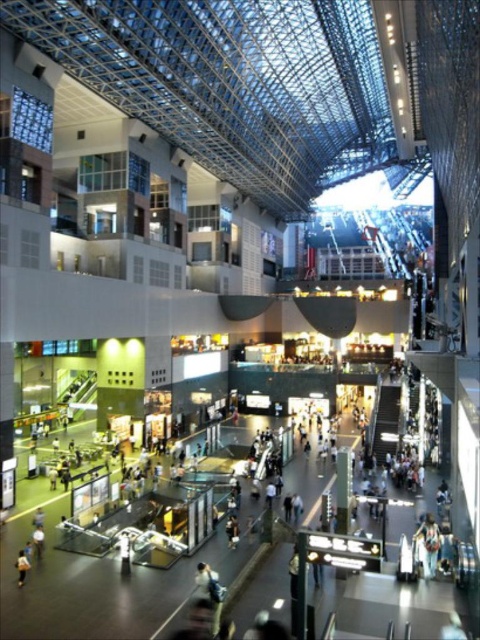
You are a delivery robot with a 100 feet range. You are currently at the floral fabric dress at center and need to deliver a package to the white fabric person at center. Can you reach them without needing to recharge?

The distance between the floral fabric dress at center and the white fabric person at center is 93.82 feet, which is within the robot 100 feet range. Therefore, the robot can reach them without needing to recharge.

You are a customer in the mall and want to pick up the floral fabric dress at center and the light brown leather jacket at lower left. However, you notice that the jacket is partially hidden. Can you tell which item is closer to you?

The light brown leather jacket at lower left is behind the floral fabric dress at center, so the floral fabric dress at center is closer to you.

You are standing at the entrance of the mall and see two points marked in the image. The first point is at coordinate point (434,564) and the second is at point (124,563). Which point is closer to you?

Point (434,564) is in front of point (124,563), so the first point is closer to you.